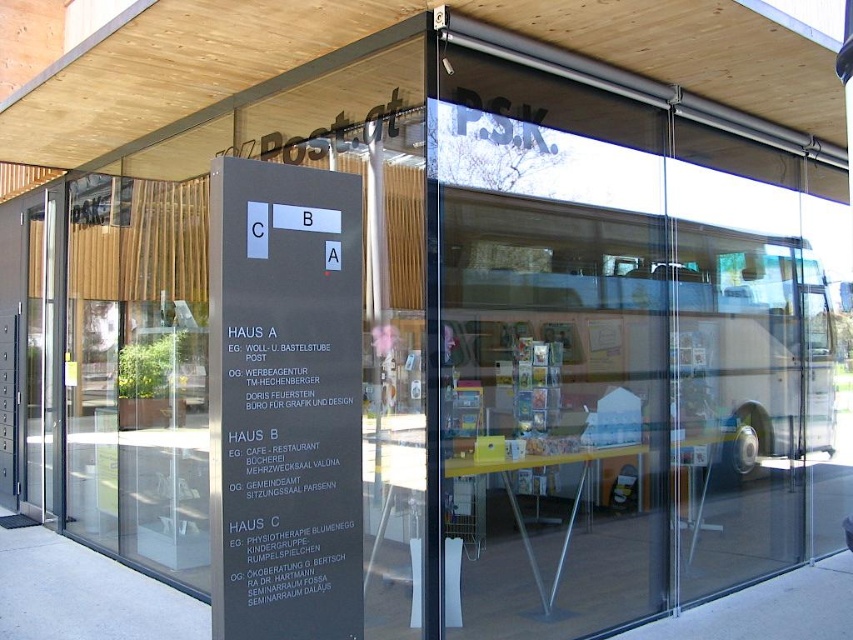
Is transparent glass door at left positioned behind black matte sign at center?

Yes, transparent glass door at left is behind black matte sign at center.

Who is more distant from viewer, (x=142, y=330) or (x=318, y=550)?

The point (x=142, y=330) is more distant.

What do you see at coordinates (138, 371) in the screenshot? The width and height of the screenshot is (853, 640). I see `transparent glass door at left` at bounding box center [138, 371].

Find the location of `transparent glass door at left`. transparent glass door at left is located at coordinates [138, 371].

Can you confirm if metallic silver bus at center is bigger than black matte sign at center?

Indeed, metallic silver bus at center has a larger size compared to black matte sign at center.

Is point (784, 387) more distant than point (347, 426)?

That is True.

I want to click on metallic silver bus at center, so click(x=630, y=337).

Is point (608, 412) farther from camera compared to point (180, 572)?

Yes.

Find the location of a particular element. This screenshot has height=640, width=853. metallic silver bus at center is located at coordinates (630, 337).

What do you see at coordinates (630, 337) in the screenshot? I see `metallic silver bus at center` at bounding box center [630, 337].

Image resolution: width=853 pixels, height=640 pixels. Identify the location of metallic silver bus at center. (630, 337).